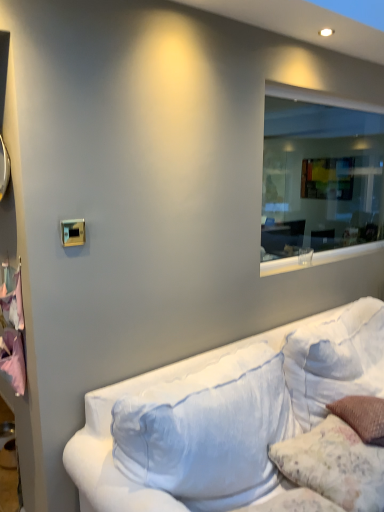
Question: Is fluffy white pillow at lower right smaller than pink fabric at left?

Choices:
 (A) no
 (B) yes

Answer: (A)

Question: Is fluffy white pillow at lower right bigger than pink fabric at left?

Choices:
 (A) no
 (B) yes

Answer: (B)

Question: Can you confirm if fluffy white pillow at lower right is taller than pink fabric at left?

Choices:
 (A) yes
 (B) no

Answer: (B)

Question: Is fluffy white pillow at lower right oriented away from pink fabric at left?

Choices:
 (A) no
 (B) yes

Answer: (A)

Question: Does fluffy white pillow at lower right have a greater width compared to pink fabric at left?

Choices:
 (A) no
 (B) yes

Answer: (B)

Question: From the image's perspective, is fluffy white pillow at lower right located above pink fabric at left?

Choices:
 (A) yes
 (B) no

Answer: (B)

Question: From the image's perspective, is white fabric couch at lower right located above transparent glass window at upper right?

Choices:
 (A) yes
 (B) no

Answer: (B)

Question: Does white fabric couch at lower right contain transparent glass window at upper right?

Choices:
 (A) yes
 (B) no

Answer: (B)

Question: Is white fabric couch at lower right closer to camera compared to transparent glass window at upper right?

Choices:
 (A) yes
 (B) no

Answer: (A)

Question: From a real-world perspective, is white fabric couch at lower right positioned under transparent glass window at upper right based on gravity?

Choices:
 (A) no
 (B) yes

Answer: (B)

Question: From the image's perspective, is white fabric couch at lower right under transparent glass window at upper right?

Choices:
 (A) yes
 (B) no

Answer: (A)

Question: Can you confirm if white fabric couch at lower right is taller than transparent glass window at upper right?

Choices:
 (A) yes
 (B) no

Answer: (B)

Question: Is pink fabric at left thinner than fluffy white pillow at lower right?

Choices:
 (A) no
 (B) yes

Answer: (B)